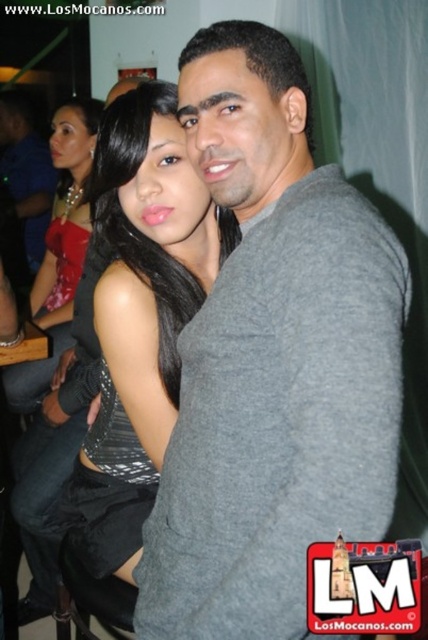
How much distance is there between satin silver dress at center and shiny red dress at upper left?

They are 36.59 inches apart.

The image size is (428, 640). What do you see at coordinates (140, 314) in the screenshot? I see `satin silver dress at center` at bounding box center [140, 314].

Where is `satin silver dress at center`? This screenshot has height=640, width=428. satin silver dress at center is located at coordinates (140, 314).

In order to click on satin silver dress at center in this screenshot , I will do `click(140, 314)`.

Who is positioned more to the left, gray cotton shirt at center or shiny red dress at upper left?

shiny red dress at upper left

Is point (237, 202) more distant than point (62, 332)?

No, (237, 202) is in front of (62, 332).

Image resolution: width=428 pixels, height=640 pixels. What do you see at coordinates (273, 360) in the screenshot?
I see `gray cotton shirt at center` at bounding box center [273, 360].

Locate an element on the screen. The image size is (428, 640). gray cotton shirt at center is located at coordinates (273, 360).

The height and width of the screenshot is (640, 428). What are the coordinates of `gray cotton shirt at center` in the screenshot? It's located at (273, 360).

Is gray cotton shirt at center taller than satin silver dress at center?

No, gray cotton shirt at center is not taller than satin silver dress at center.

Does point (235, 177) come behind point (151, 326)?

No, it is not.

Image resolution: width=428 pixels, height=640 pixels. In order to click on gray cotton shirt at center in this screenshot , I will do pos(273,360).